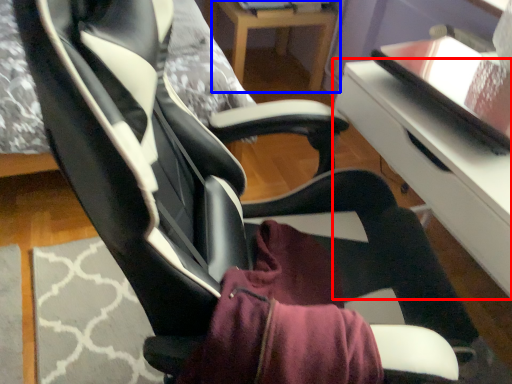
Question: Among these objects, which one is farthest to the camera, table (highlighted by a red box) or table (highlighted by a blue box)?

Choices:
 (A) table
 (B) table

Answer: (B)